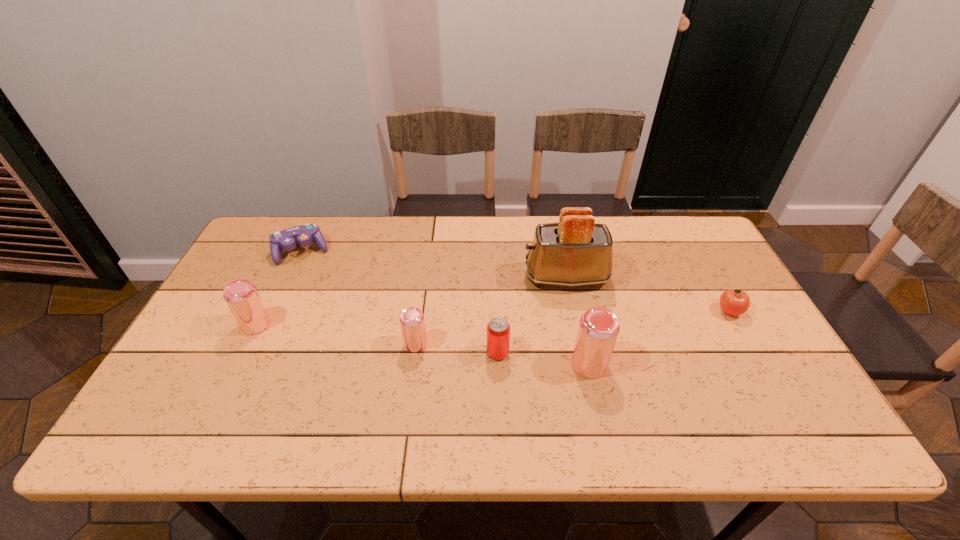
Where is `the second shortest beer can`? The height and width of the screenshot is (540, 960). the second shortest beer can is located at coordinates (241, 296).

Identify the location of the third tallest object. (241, 296).

Locate an element on the screen. The image size is (960, 540). the fifth object from right to left is located at coordinates (411, 319).

Identify the location of the second beer can from left to right. (411, 319).

This screenshot has width=960, height=540. I want to click on the tallest beer can, so click(598, 329).

The image size is (960, 540). I want to click on the second tallest object, so click(598, 329).

Locate an element on the screen. This screenshot has width=960, height=540. toaster is located at coordinates (575, 252).

Where is `control`? control is located at coordinates (287, 239).

The width and height of the screenshot is (960, 540). In order to click on the sixth tallest object in this screenshot , I will do `click(734, 302)`.

Locate an element on the screen. The width and height of the screenshot is (960, 540). the rightmost object is located at coordinates (734, 302).